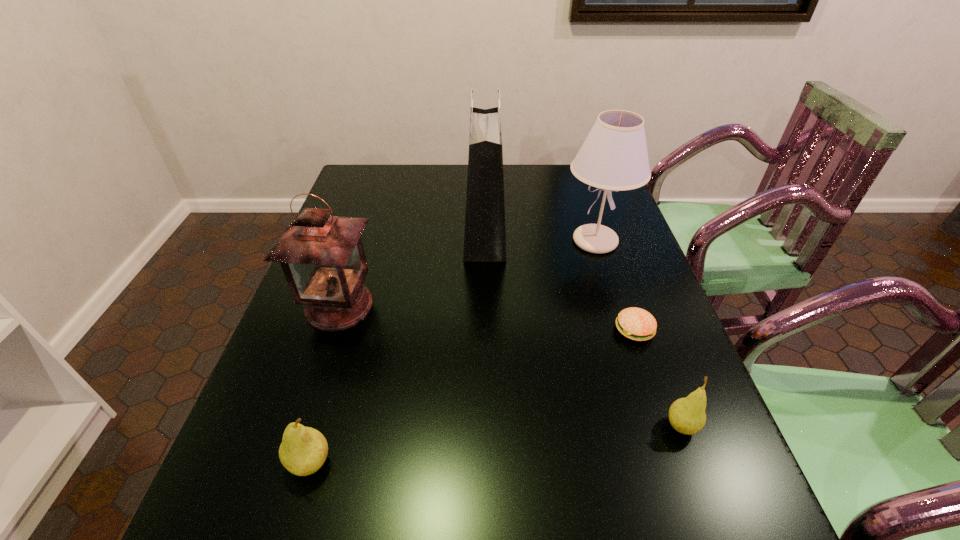
Image resolution: width=960 pixels, height=540 pixels. I want to click on free spot that satisfies the following two spatial constraints: 1. on the front with handles of the shopping bag; 2. on the left side of the fifth tallest object, so click(487, 427).

You are a GUI agent. You are given a task and a screenshot of the screen. Output one action in this format:
    pyautogui.click(x=<x>, y=<y>)
    Task: Click on the free space in the image that satisfies the following two spatial constraints: 1. on the back side of the third shortest object; 2. on the left side of the shortest object
    This screenshot has height=540, width=960.
    Given the screenshot: What is the action you would take?
    pyautogui.click(x=349, y=330)

Where is `free space that satisfies the following two spatial constraints: 1. on the back side of the lampshade; 2. on the front with handles of the shopping bag`? This screenshot has width=960, height=540. free space that satisfies the following two spatial constraints: 1. on the back side of the lampshade; 2. on the front with handles of the shopping bag is located at coordinates (592, 232).

Find the location of a particular element. free space that satisfies the following two spatial constraints: 1. on the front with handles of the shopping bag; 2. on the back side of the lampshade is located at coordinates (485, 241).

Locate an element on the screen. This screenshot has width=960, height=540. free space that satisfies the following two spatial constraints: 1. on the front side of the oil lamp; 2. on the left side of the left pear is located at coordinates (287, 463).